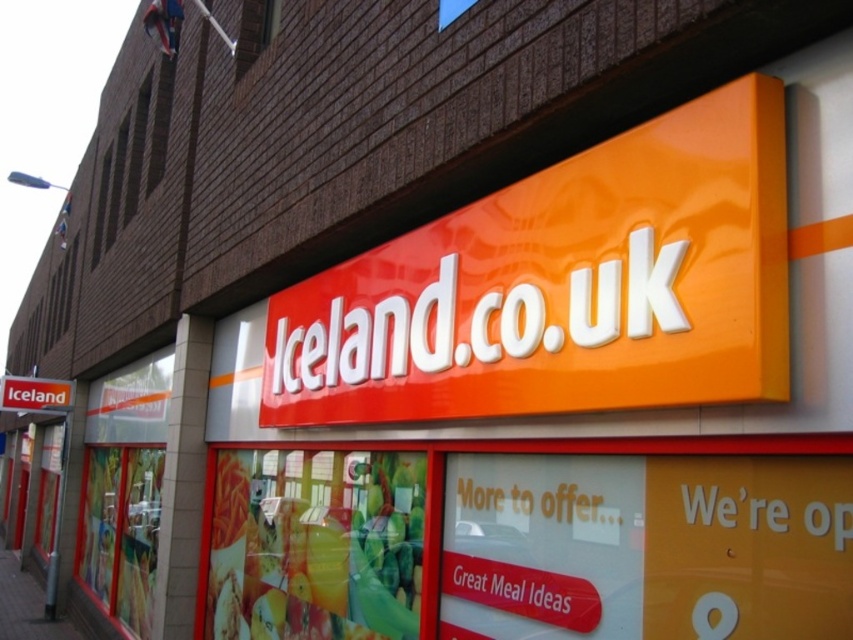
Can you confirm if orange glossy sign at upper center is taller than smooth concrete pavement at lower left?

No, orange glossy sign at upper center is not taller than smooth concrete pavement at lower left.

Does point (590, 298) come behind point (45, 636)?

No, (590, 298) is closer to viewer.

Identify the location of orange glossy sign at upper center. Image resolution: width=853 pixels, height=640 pixels. (563, 285).

Does smooth concrete pavement at lower left come behind orange glossy sign at center?

No, it is not.

Does smooth concrete pavement at lower left have a larger size compared to orange glossy sign at center?

Indeed, smooth concrete pavement at lower left has a larger size compared to orange glossy sign at center.

Between point (68, 632) and point (47, 388), which one is positioned behind?

Point (47, 388)

At what (x,y) coordinates should I click in order to perform the action: click on smooth concrete pavement at lower left. Please return your answer as a coordinate pair (x, y). This screenshot has height=640, width=853. Looking at the image, I should click on (25, 604).

Who is shorter, orange glossy sign at upper center or orange glossy sign at center?

orange glossy sign at center is shorter.

Does point (540, 333) lie behind point (57, 406)?

That is False.

Where is `orange glossy sign at upper center`? orange glossy sign at upper center is located at coordinates (563, 285).